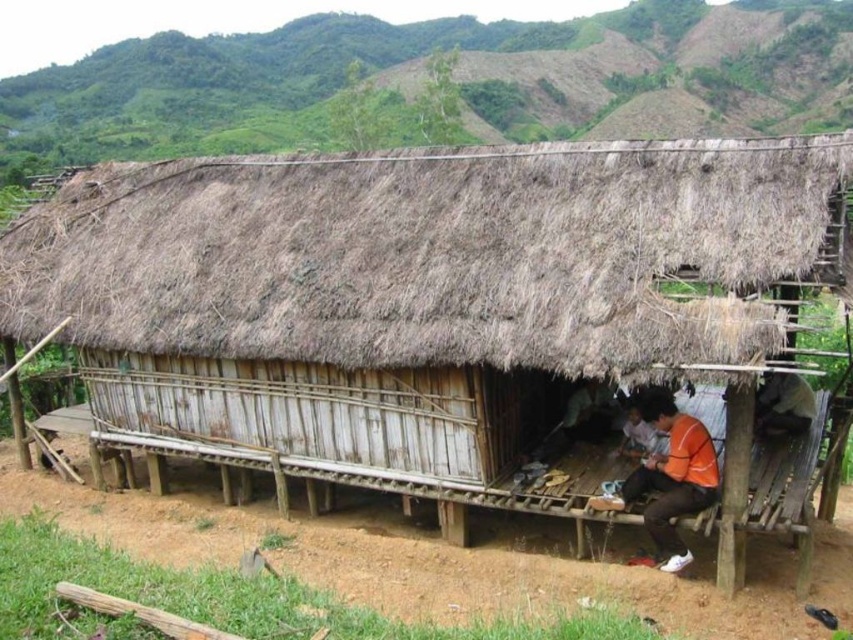
Measure the distance from green grassy hillside at upper center to orange fabric shirt at lower center.

green grassy hillside at upper center is 121.77 feet away from orange fabric shirt at lower center.

Can you confirm if green grassy hillside at upper center is taller than orange fabric shirt at lower center?

Yes, green grassy hillside at upper center is taller than orange fabric shirt at lower center.

This screenshot has height=640, width=853. I want to click on green grassy hillside at upper center, so click(x=440, y=83).

Identify the location of green grassy hillside at upper center. (440, 83).

Can you confirm if brown thatch at center is positioned to the right of green grassy hillside at upper center?

No, brown thatch at center is not to the right of green grassy hillside at upper center.

Can you confirm if brown thatch at center is thinner than green grassy hillside at upper center?

Yes, brown thatch at center is thinner than green grassy hillside at upper center.

Is point (167, 221) behind point (347, 45)?

No, (167, 221) is closer to viewer.

At what (x,y) coordinates should I click in order to perform the action: click on brown thatch at center. Please return your answer as a coordinate pair (x, y). Looking at the image, I should click on (431, 253).

How much distance is there between brown thatch at center and orange fabric shirt at lower center?

brown thatch at center is 9.47 feet from orange fabric shirt at lower center.

Consider the image. Is brown thatch at center smaller than orange fabric shirt at lower center?

Actually, brown thatch at center might be larger than orange fabric shirt at lower center.

The height and width of the screenshot is (640, 853). I want to click on brown thatch at center, so click(431, 253).